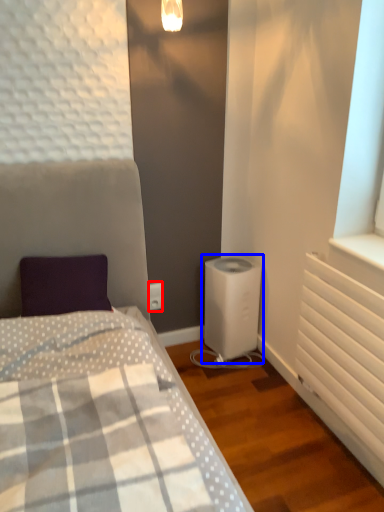
Question: Which of the following is the farthest to the observer, electric outlet (highlighted by a red box) or water heater (highlighted by a blue box)?

Choices:
 (A) electric outlet
 (B) water heater

Answer: (A)